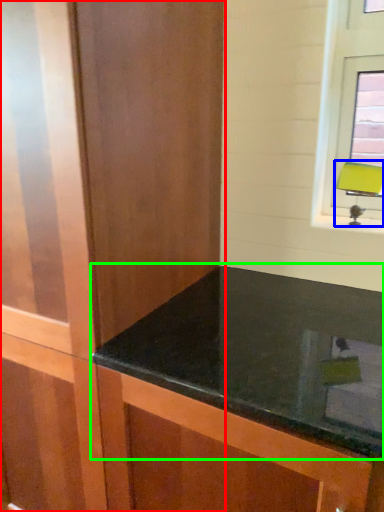
Question: Considering the real-world distances, which object is farthest from dresser (highlighted by a red box)? table lamp (highlighted by a blue box) or countertop (highlighted by a green box)?

Choices:
 (A) table lamp
 (B) countertop

Answer: (A)